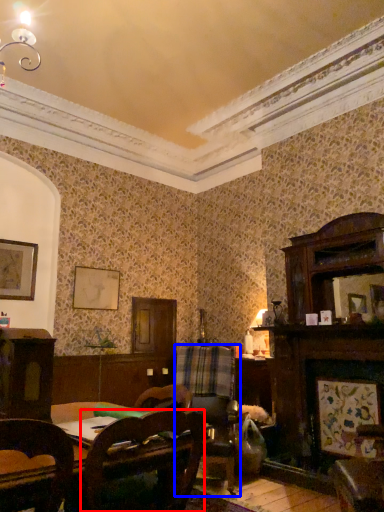
Question: Which object is closer to the camera taking this photo, chair (highlighted by a red box) or swivel chair (highlighted by a blue box)?

Choices:
 (A) chair
 (B) swivel chair

Answer: (A)